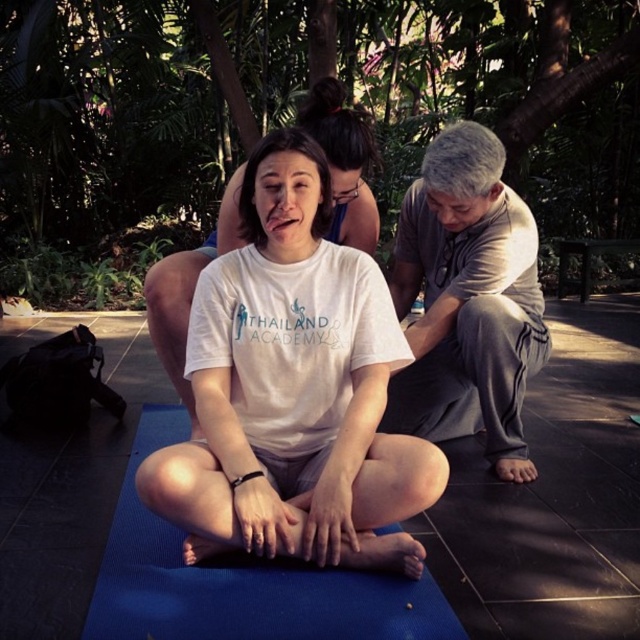
You are a photographer setting up for a yoga session. You need to place a gray cotton shirt at upper right and a blue rubber yoga mat at center in the frame. According to the scene, which object is located to the right of the other?

The gray cotton shirt at upper right is positioned on the right side of blue rubber yoga mat at center.